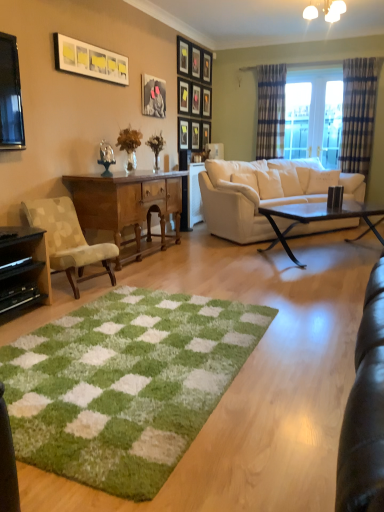
Question: Does beige fabric chair at left contain matte black picture frame at upper center, which is the third picture frame in back-to-front order?

Choices:
 (A) no
 (B) yes

Answer: (A)

Question: Is beige fabric chair at left further to the viewer compared to matte black picture frame at upper center, the 9th picture frame when ordered from front to back?

Choices:
 (A) no
 (B) yes

Answer: (A)

Question: Is beige fabric chair at left wider than matte black picture frame at upper center, the 9th picture frame when ordered from front to back?

Choices:
 (A) no
 (B) yes

Answer: (B)

Question: Is beige fabric chair at left to the left of matte black picture frame at upper center, which is the third picture frame in back-to-front order, from the viewer's perspective?

Choices:
 (A) no
 (B) yes

Answer: (B)

Question: Does beige fabric chair at left lie in front of matte black picture frame at upper center, the 9th picture frame when ordered from front to back?

Choices:
 (A) yes
 (B) no

Answer: (A)

Question: In terms of width, does white glossy picture frame at upper left, which is the eleventh picture frame from back to front, look wider or thinner when compared to black matte entertainment center at lower left?

Choices:
 (A) thin
 (B) wide

Answer: (A)

Question: Considering the relative positions of white glossy picture frame at upper left, which is the eleventh picture frame from back to front, and black matte entertainment center at lower left in the image provided, is white glossy picture frame at upper left, which is the eleventh picture frame from back to front, to the left or to the right of black matte entertainment center at lower left?

Choices:
 (A) left
 (B) right

Answer: (B)

Question: From the image's perspective, relative to black matte entertainment center at lower left, is white glossy picture frame at upper left, which ranks as the 1th picture frame in front-to-back order, above or below?

Choices:
 (A) below
 (B) above

Answer: (B)

Question: From a real-world perspective, is white glossy picture frame at upper left, which is the eleventh picture frame from back to front, positioned above or below black matte entertainment center at lower left?

Choices:
 (A) above
 (B) below

Answer: (A)

Question: From the image's perspective, is translucent glass vase at center, the second houseplant when ordered from back to front, positioned above or below white leather couch at center?

Choices:
 (A) above
 (B) below

Answer: (A)

Question: Considering the relative positions of translucent glass vase at center, which is the first houseplant from left to right, and white leather couch at center in the image provided, is translucent glass vase at center, which is the first houseplant from left to right, to the left or to the right of white leather couch at center?

Choices:
 (A) left
 (B) right

Answer: (A)

Question: Looking at their shapes, would you say translucent glass vase at center, which is the first houseplant from left to right, is wider or thinner than white leather couch at center?

Choices:
 (A) thin
 (B) wide

Answer: (A)

Question: Considering their positions, is translucent glass vase at center, the second houseplant when ordered from back to front, located in front of or behind white leather couch at center?

Choices:
 (A) behind
 (B) front

Answer: (B)

Question: In terms of width, does wooden picture frame at center, the 8th picture frame in the front-to-back sequence, look wider or thinner when compared to matte black picture frame at upper center, which is counted as the fifth picture frame, starting from the back?

Choices:
 (A) thin
 (B) wide

Answer: (A)

Question: Is wooden picture frame at center, the 8th picture frame in the front-to-back sequence, situated inside matte black picture frame at upper center, which is counted as the fifth picture frame, starting from the back, or outside?

Choices:
 (A) inside
 (B) outside

Answer: (B)